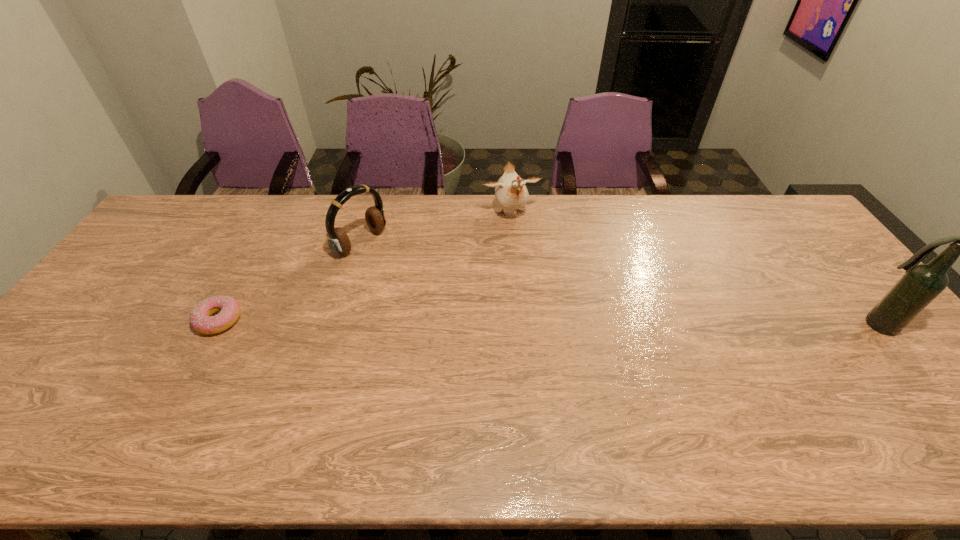
Where is `vacant space on the desktop that is between the leftmost object and the beer bottle and is positioned on the ear cup of the headset`? This screenshot has height=540, width=960. vacant space on the desktop that is between the leftmost object and the beer bottle and is positioned on the ear cup of the headset is located at coordinates (489, 322).

Where is `free space on the desktop that is between the leftmost object and the rightmost object and is positioned at the beak of the third object from left to right`? Image resolution: width=960 pixels, height=540 pixels. free space on the desktop that is between the leftmost object and the rightmost object and is positioned at the beak of the third object from left to right is located at coordinates (553, 323).